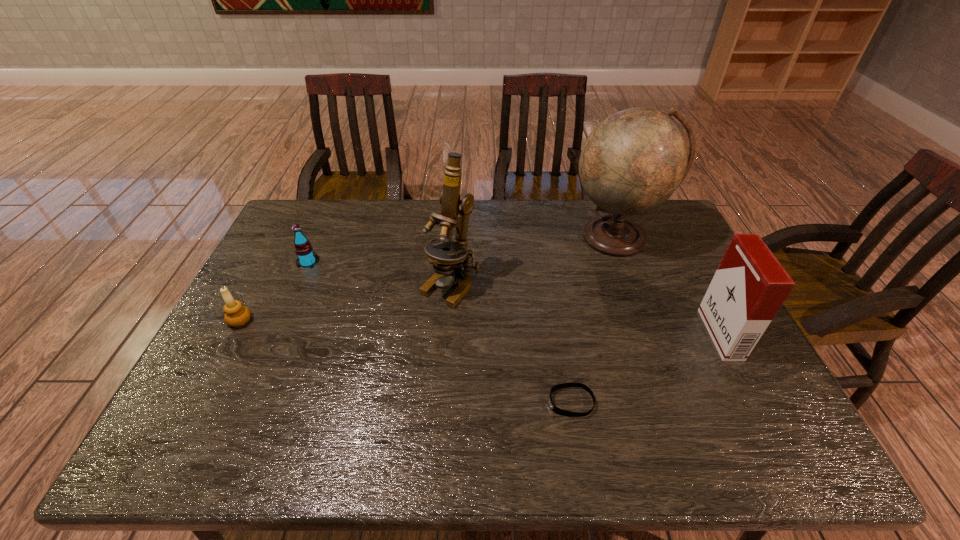
Find the location of a particular element. The height and width of the screenshot is (540, 960). object identified as the fourth closest to the microscope is located at coordinates (236, 314).

You are a GUI agent. You are given a task and a screenshot of the screen. Output one action in this format:
    pyautogui.click(x=<x>, y=<y>)
    Task: Click on the free space in the image that satisfies the following two spatial constraints: 1. on the front-facing side of the globe; 2. on the display of the shortest object
    This screenshot has height=540, width=960.
    Given the screenshot: What is the action you would take?
    pyautogui.click(x=678, y=402)

In order to click on free point that satisfies the following two spatial constraints: 1. on the front-facing side of the globe; 2. on the display of the shortest object in this screenshot , I will do `click(678, 402)`.